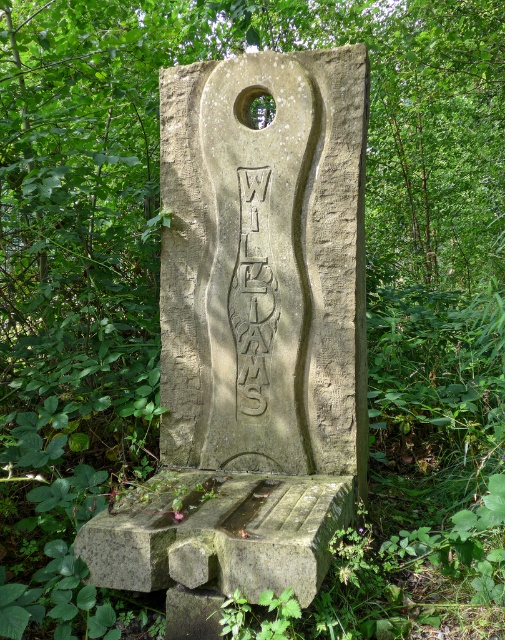
Question: Is stone carving at center thinner than carved stone text at center?

Choices:
 (A) no
 (B) yes

Answer: (A)

Question: Among these objects, which one is nearest to the camera?

Choices:
 (A) stone carving at center
 (B) carved stone text at center

Answer: (A)

Question: Which point is farther to the camera?

Choices:
 (A) stone carving at center
 (B) carved stone text at center

Answer: (B)

Question: Is stone carving at center to the left of carved stone text at center from the viewer's perspective?

Choices:
 (A) no
 (B) yes

Answer: (A)

Question: Is stone carving at center below carved stone text at center?

Choices:
 (A) yes
 (B) no

Answer: (A)

Question: Which of the following is the closest to the observer?

Choices:
 (A) (257, 312)
 (B) (266, 300)

Answer: (B)